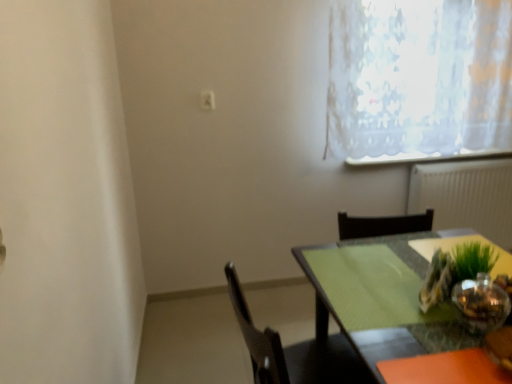
This screenshot has height=384, width=512. Describe the element at coordinates (371, 306) in the screenshot. I see `green matte table at lower right` at that location.

This screenshot has height=384, width=512. I want to click on green glass vase at right, so point(453,266).

This screenshot has width=512, height=384. What are the coordinates of `white textured radiator at right` in the screenshot? It's located at (466, 196).

What are the coordinates of `green matte table at lower right` in the screenshot? It's located at (371, 306).

From the image's perspective, is black matte chair at lower center, which appears as the second chair when viewed from the top, located beneath green matte table at lower right?

Actually, black matte chair at lower center, which appears as the second chair when viewed from the top, appears above green matte table at lower right in the image.

Which object is thinner, black matte chair at lower center, which appears as the second chair when viewed from the top, or green matte table at lower right?

black matte chair at lower center, which appears as the second chair when viewed from the top.

From the picture: Could you tell me if black matte chair at lower center, which appears as the second chair when viewed from the top, is turned towards green matte table at lower right?

Yes.

Which of these two, white textured radiator at right or green matte table at lower right, stands taller?

green matte table at lower right.

From the picture: Considering the relative positions of white textured radiator at right and green matte table at lower right in the image provided, is white textured radiator at right to the right of green matte table at lower right from the viewer's perspective?

Indeed, white textured radiator at right is positioned on the right side of green matte table at lower right.

Which of these two, white textured radiator at right or green matte table at lower right, is bigger?

green matte table at lower right is bigger.

From a real-world perspective, is white textured radiator at right below green matte table at lower right?

No, from a real-world perspective, white textured radiator at right is not beneath green matte table at lower right.

Image resolution: width=512 pixels, height=384 pixels. Identify the location of houseplant behind the green glass table at center, the first chair in the top-to-bottom sequence. (453, 266).

Can you confirm if green glass vase at right is shorter than green glass table at center, the first chair in the top-to-bottom sequence?

No, green glass vase at right is not shorter than green glass table at center, the first chair in the top-to-bottom sequence.

From the image's perspective, is green glass vase at right over green glass table at center, the second chair in the bottom-to-top sequence?

Yes, from the image's perspective, green glass vase at right is over green glass table at center, the second chair in the bottom-to-top sequence.

Is black matte chair at lower center, which appears as the second chair when viewed from the top, facing away from green glass vase at right?

No, black matte chair at lower center, which appears as the second chair when viewed from the top,'s orientation is not away from green glass vase at right.

How different are the orientations of black matte chair at lower center, which is the 1th chair in bottom-to-top order, and green glass vase at right in degrees?

The angle between the facing direction of black matte chair at lower center, which is the 1th chair in bottom-to-top order, and the facing direction of green glass vase at right is 18.8 degrees.

Are black matte chair at lower center, which appears as the second chair when viewed from the top, and green glass vase at right far apart?

They are positioned close to each other.

From a real-world perspective, starting from the green glass vase at right, which chair is the 2nd one below it? Please provide its 2D coordinates.

[(295, 351)]

Is black matte chair at lower center, which appears as the second chair when viewed from the top, at the back of green glass vase at right?

No, green glass vase at right's orientation is not away from black matte chair at lower center, which appears as the second chair when viewed from the top.

Considering the sizes of objects green glass vase at right and black matte chair at lower center, which appears as the second chair when viewed from the top, in the image provided, who is taller, green glass vase at right or black matte chair at lower center, which appears as the second chair when viewed from the top,?

With more height is black matte chair at lower center, which appears as the second chair when viewed from the top.

Between green glass vase at right and black matte chair at lower center, which is the 1th chair in bottom-to-top order, which one appears on the left side from the viewer's perspective?

black matte chair at lower center, which is the 1th chair in bottom-to-top order.

How different are the orientations of green glass vase at right and white textured radiator at right in degrees?

They differ by 119 degrees in their facing directions.

The height and width of the screenshot is (384, 512). I want to click on radiator located above the green glass vase at right (from the image's perspective), so click(x=466, y=196).

Is white textured radiator at right at the back of green glass vase at right?

That's not correct — green glass vase at right is not looking away from white textured radiator at right.

Consider the image. Can we say green glass vase at right lies outside white textured radiator at right?

Yes, green glass vase at right is outside of white textured radiator at right.

Consider the image. Who is shorter, black matte chair at lower center, which is the 1th chair in bottom-to-top order, or green glass table at center, the second chair in the bottom-to-top sequence?

Standing shorter between the two is green glass table at center, the second chair in the bottom-to-top sequence.

Would you say black matte chair at lower center, which is the 1th chair in bottom-to-top order, is inside or outside green glass table at center, the first chair in the top-to-bottom sequence?

black matte chair at lower center, which is the 1th chair in bottom-to-top order, is spatially situated outside green glass table at center, the first chair in the top-to-bottom sequence.

Is black matte chair at lower center, which appears as the second chair when viewed from the top, not near green glass table at center, the first chair in the top-to-bottom sequence?

No, black matte chair at lower center, which appears as the second chair when viewed from the top, is in close proximity to green glass table at center, the first chair in the top-to-bottom sequence.

The image size is (512, 384). There is a green matte table at lower right. In order to click on the 1st chair above it (from a real-world perspective) in this screenshot , I will do point(295,351).

Locate an element on the screen. table below the white textured radiator at right (from the image's perspective) is located at coordinates (371, 306).

Looking at the image, which one is located closer to green matte table at lower right, green glass table at center, the first chair in the top-to-bottom sequence, or green glass vase at right?

green glass vase at right.

In the scene shown: Which object lies nearer to the anchor point green glass vase at right, green matte table at lower right or white lace curtain at upper right?

green matte table at lower right lies closer to green glass vase at right than the other object.

Considering their positions, is green glass table at center, the second chair in the bottom-to-top sequence, positioned further to white textured radiator at right than black matte chair at lower center, which appears as the second chair when viewed from the top?

Among the two, black matte chair at lower center, which appears as the second chair when viewed from the top, is located further to white textured radiator at right.

Based on their spatial positions, is green glass vase at right or white lace curtain at upper right further from green glass table at center, the first chair in the top-to-bottom sequence?

white lace curtain at upper right lies further to green glass table at center, the first chair in the top-to-bottom sequence, than the other object.

From the image, which object appears to be farther from green glass table at center, the first chair in the top-to-bottom sequence, green matte table at lower right or white lace curtain at upper right?

white lace curtain at upper right.

Based on their spatial positions, is green glass table at center, the first chair in the top-to-bottom sequence, or green matte table at lower right further from white textured radiator at right?

Based on the image, green matte table at lower right appears to be further to white textured radiator at right.

Estimate the real-world distances between objects in this image. Which object is closer to green matte table at lower right, black matte chair at lower center, which appears as the second chair when viewed from the top, or green glass table at center, the first chair in the top-to-bottom sequence?

black matte chair at lower center, which appears as the second chair when viewed from the top, is closer to green matte table at lower right.

Which object lies nearer to the anchor point white textured radiator at right, green glass vase at right or green matte table at lower right?

Based on the image, green matte table at lower right appears to be nearer to white textured radiator at right.

Where is `window positioned between green glass table at center, the first chair in the top-to-bottom sequence, and white textured radiator at right from near to far`? This screenshot has height=384, width=512. window positioned between green glass table at center, the first chair in the top-to-bottom sequence, and white textured radiator at right from near to far is located at coordinates tap(419, 80).

Identify the location of houseplant between green matte table at lower right and white textured radiator at right from front to back. (453, 266).

Locate an element on the screen. This screenshot has height=384, width=512. table located between black matte chair at lower center, which is the 1th chair in bottom-to-top order, and green glass vase at right in the left-right direction is located at coordinates (371, 306).

Where is `houseplant between white lace curtain at upper right and green matte table at lower right from top to bottom`? The height and width of the screenshot is (384, 512). houseplant between white lace curtain at upper right and green matte table at lower right from top to bottom is located at coordinates point(453,266).